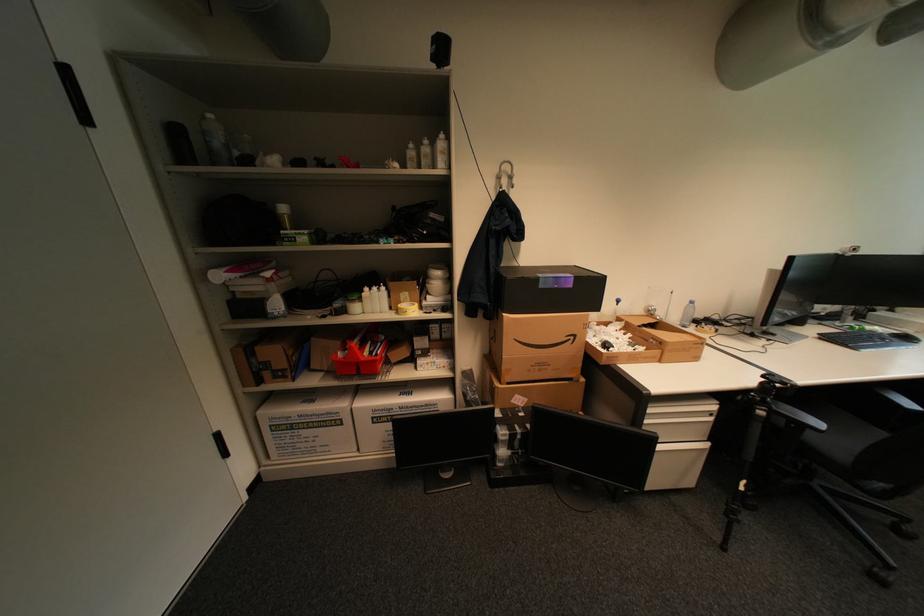
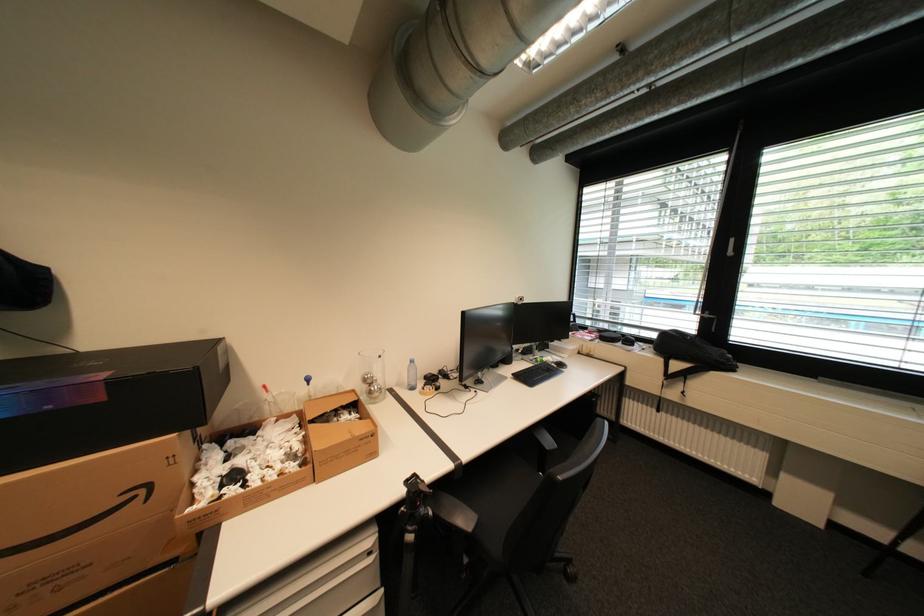
The point at (x=891, y=331) is marked in the first image. Where is the corresponding point in the second image?

(560, 361)